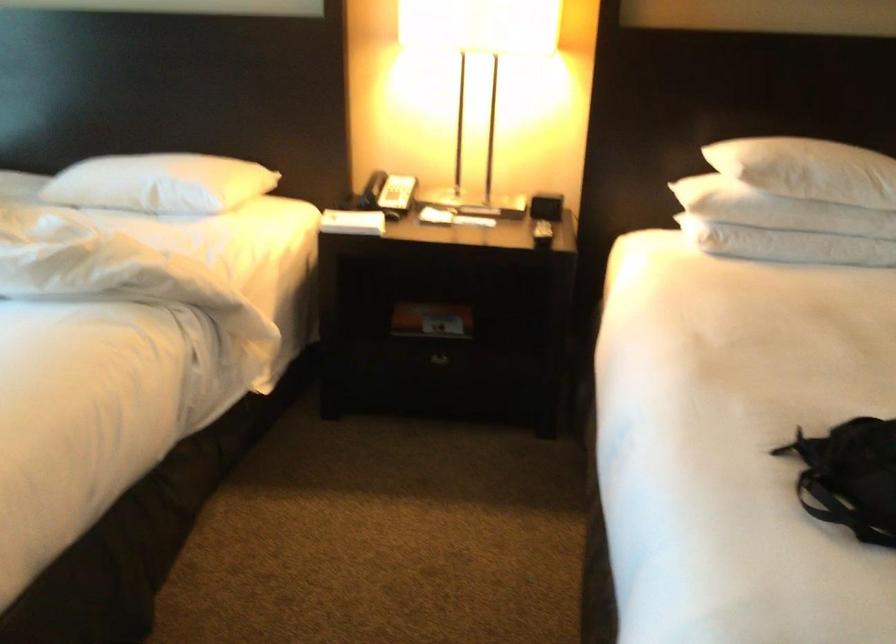
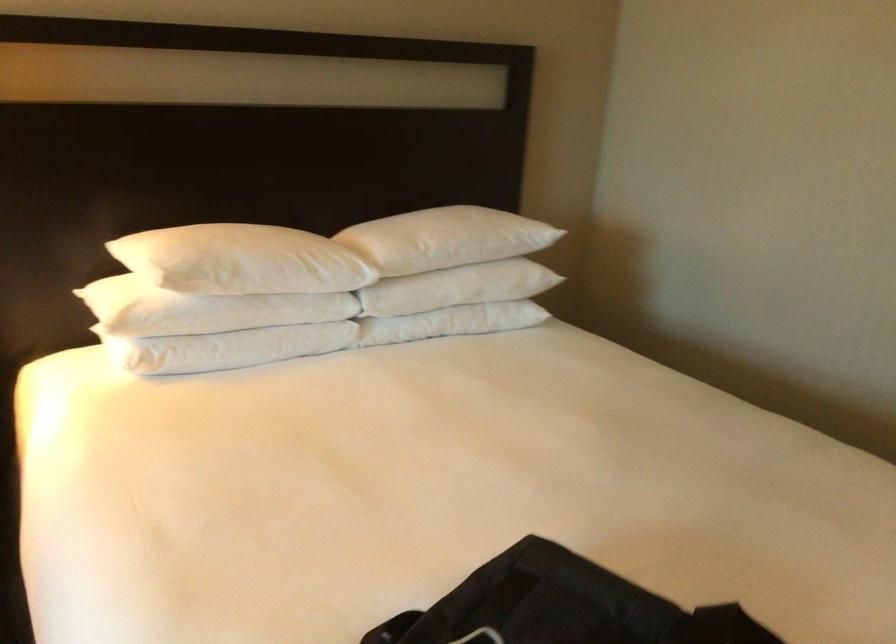
Question: The camera is either moving clockwise (left) or counter-clockwise (right) around the object. The first image is from the beginning of the video and the second image is from the end. Is the camera moving left or right when shooting the video?

Choices:
 (A) Left
 (B) Right

Answer: (A)